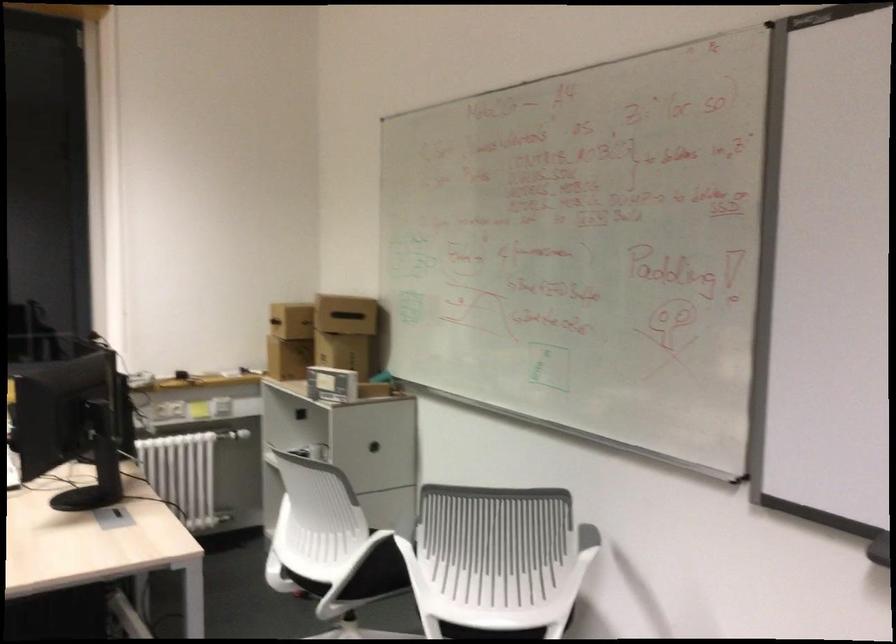
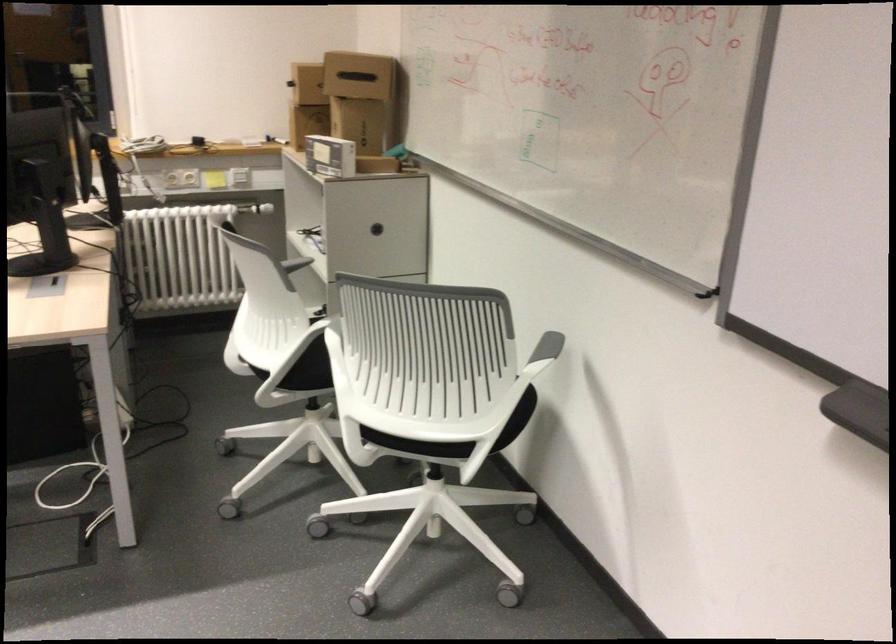
Where in the second image is the point corresponding to point 351,361 from the first image?

(366, 131)